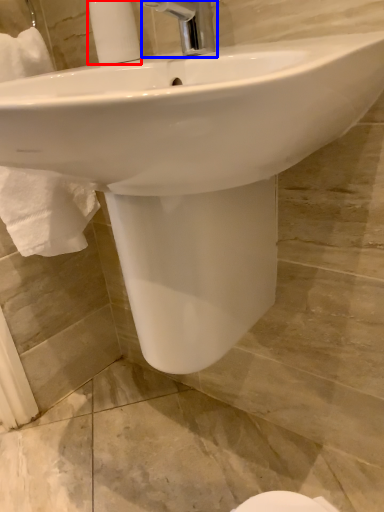
Question: Which object is closer to the camera taking this photo, soap dispenser (highlighted by a red box) or tap (highlighted by a blue box)?

Choices:
 (A) soap dispenser
 (B) tap

Answer: (B)